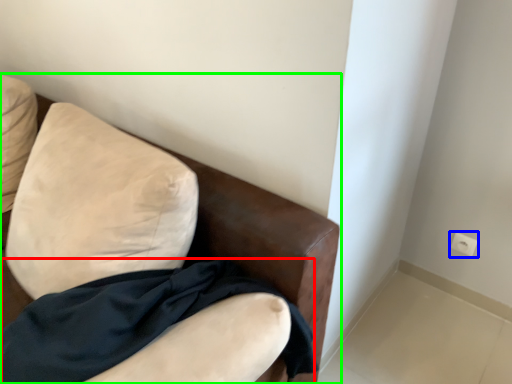
Question: Which object is the closest to the fabric (highlighted by a red box)? Choose among these: electric outlet (highlighted by a blue box) or furniture (highlighted by a green box).

Choices:
 (A) electric outlet
 (B) furniture

Answer: (B)